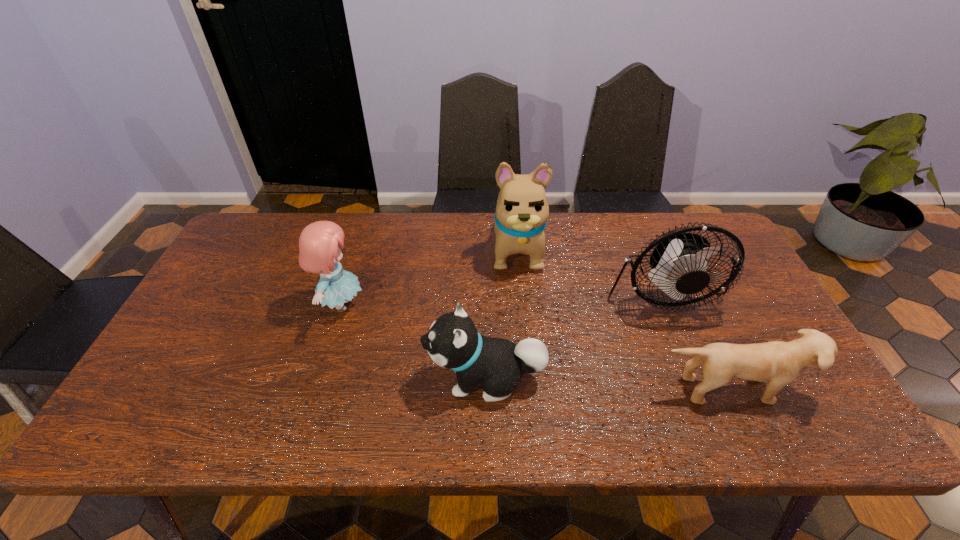
You are a GUI agent. You are given a task and a screenshot of the screen. Output one action in this format:
    pyautogui.click(x=<x>, y=<y>)
    Task: Click on the empty location between the tallest puppy and the leftmost object
    This screenshot has height=540, width=960.
    Given the screenshot: What is the action you would take?
    pyautogui.click(x=429, y=276)

Identify the location of vacant region between the fan and the shortest puppy. (695, 340).

Image resolution: width=960 pixels, height=540 pixels. In order to click on the fourth closest object to the shortest object in this screenshot , I will do `click(320, 243)`.

Locate which object is the second closest to the farthest puppy. Please provide its 2D coordinates. Your answer should be formatted as a tuple, i.e. [(x, y)], where the tuple contains the x and y coordinates of a point satisfying the conditions above.

[(452, 341)]

Identify which puppy is located as the nearest to the shortest puppy. Please provide its 2D coordinates. Your answer should be formatted as a tuple, i.e. [(x, y)], where the tuple contains the x and y coordinates of a point satisfying the conditions above.

[(452, 341)]

Point out which puppy is positioned as the second nearest to the farthest puppy. Please provide its 2D coordinates. Your answer should be formatted as a tuple, i.e. [(x, y)], where the tuple contains the x and y coordinates of a point satisfying the conditions above.

[(781, 362)]

The height and width of the screenshot is (540, 960). What are the coordinates of `vacant space that satisfies the following two spatial constraints: 1. on the face of the tallest puppy; 2. on the front-facing side of the doll` in the screenshot? It's located at (522, 305).

Locate an element on the screen. vacant space that satisfies the following two spatial constraints: 1. in front of the fan, directing airflow; 2. on the front-facing side of the doll is located at coordinates tap(667, 305).

Locate an element on the screen. Image resolution: width=960 pixels, height=540 pixels. vacant point that satisfies the following two spatial constraints: 1. on the face of the tallest puppy; 2. on the front-facing side of the leftmost object is located at coordinates (522, 305).